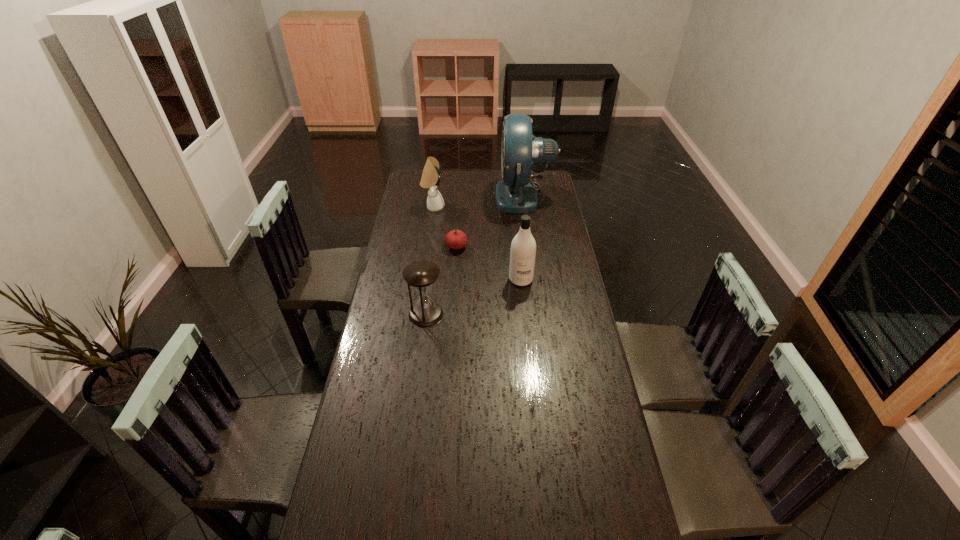
You are a GUI agent. You are given a task and a screenshot of the screen. Output one action in this format:
    pyautogui.click(x=<x>, y=<y>)
    Task: Click on the vacant space that satisfies the following two spatial constraints: 1. in front of the tallest object to blow air; 2. on the front-facing side of the second nearest object
    
    Given the screenshot: What is the action you would take?
    pyautogui.click(x=536, y=279)

Find the location of a particular element. The width and height of the screenshot is (960, 540). vacant area that satisfies the following two spatial constraints: 1. at the front face of the tomato; 2. on the right side of the doll is located at coordinates (427, 247).

You are a GUI agent. You are given a task and a screenshot of the screen. Output one action in this format:
    pyautogui.click(x=<x>, y=<y>)
    Task: Click on the free space that satisfies the following two spatial constraints: 1. in front of the tallest object to blow air; 2. on the front-facing side of the fourth farthest object
    The image size is (960, 540).
    Given the screenshot: What is the action you would take?
    pyautogui.click(x=536, y=279)